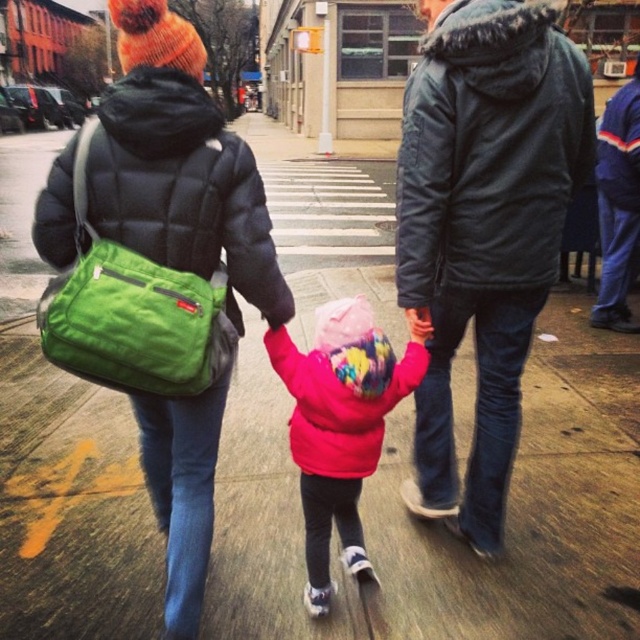
Question: Which point is closer to the camera?

Choices:
 (A) (358, 316)
 (B) (198, 172)
 (C) (612, 291)
 (D) (532, 65)

Answer: (B)

Question: In this image, where is matte black jacket at upper left located relative to blue fleece jacket at right?

Choices:
 (A) above
 (B) below

Answer: (B)

Question: Estimate the real-world distances between objects in this image. Which object is closer to the blue fleece jacket at right?

Choices:
 (A) matte black jacket at upper left
 (B) green fabric bag at upper left
 (C) matte pink coat at center
 (D) dark blue puffy jacket at upper center

Answer: (D)

Question: Which point is closer to the camera?

Choices:
 (A) (396, 268)
 (B) (97, 216)

Answer: (B)

Question: From the image, what is the correct spatial relationship of green fabric bag at upper left in relation to matte pink coat at center?

Choices:
 (A) above
 (B) below

Answer: (A)

Question: Is green fabric bag at upper left wider than dark blue puffy jacket at upper center?

Choices:
 (A) no
 (B) yes

Answer: (B)